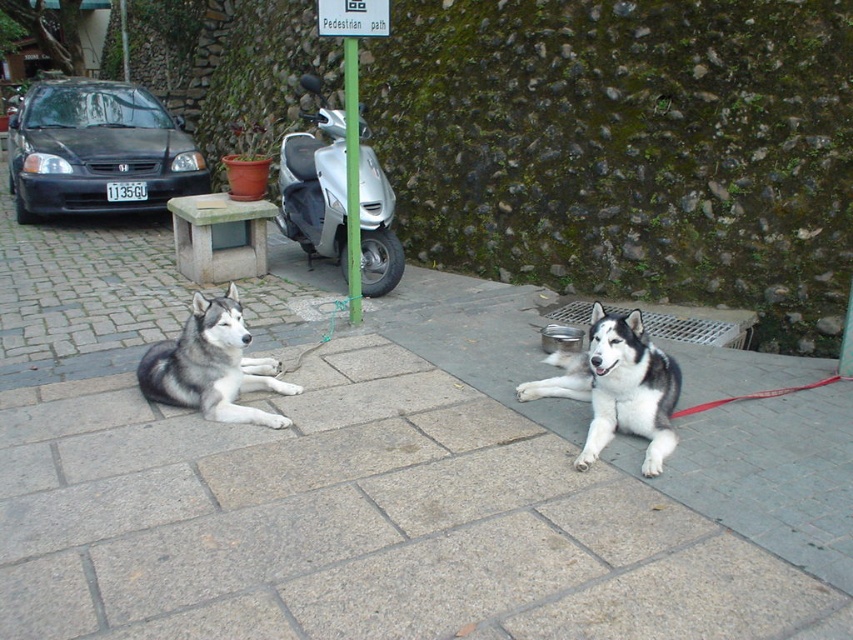
You are standing at the origin point of the coordinate system. You want to walk to the gray stone pavement at center. In which direction should you move?

The gray stone pavement at center is located at coordinate point (383,480). Since you are at the origin point, you should move towards the positive x and positive y directions to reach it.

You are standing in the outdoor scene and want to take a photo of the gray fur husky at center without including the gray stone pavement at center in the frame. Is it possible to adjust your position to achieve this?

The gray stone pavement at center is closer to the viewer than the gray fur husky at center. By moving your position so that the husky is positioned behind the pavement, you can frame the shot to exclude the pavement while focusing on the husky.